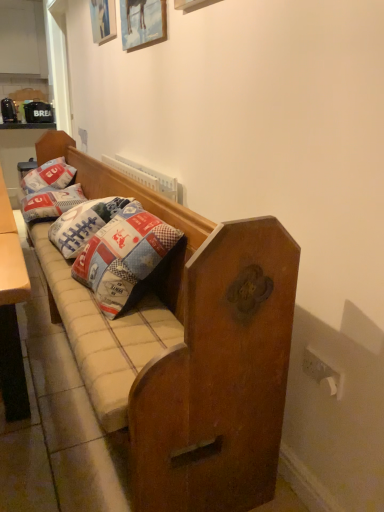
Locate an element on the screen. The image size is (384, 512). wooden studio couch at center is located at coordinates (186, 353).

This screenshot has width=384, height=512. In order to click on wooden picture frame at upper center, marked as the second picture frame in a left-to-right arrangement in this screenshot , I will do `click(142, 22)`.

Identify the location of white glossy cabinet at upper left. (22, 38).

Image resolution: width=384 pixels, height=512 pixels. What do you see at coordinates (22, 38) in the screenshot?
I see `white glossy cabinet at upper left` at bounding box center [22, 38].

Describe the element at coordinates (50, 203) in the screenshot. I see `patchwork fabric pillow at left, arranged as the 1th pillow when viewed from the front` at that location.

You are a GUI agent. You are given a task and a screenshot of the screen. Output one action in this format:
    pyautogui.click(x=<x>, y=<y>)
    Task: Click on the wooden picture frame at upper center, the second picture frame viewed from the right
    
    Given the screenshot: What is the action you would take?
    pyautogui.click(x=103, y=20)

From the image's perspective, which one is positioned lower, white glossy cabinet at upper left or patchwork fabric pillow at left, the second pillow in the front-to-back sequence?

patchwork fabric pillow at left, the second pillow in the front-to-back sequence, appears lower in the image.

At what (x,y) coordinates should I click in order to perform the action: click on cabinetry above the patchwork fabric pillow at left, the second pillow in the front-to-back sequence (from a real-world perspective). Please return your answer as a coordinate pair (x, y). The image size is (384, 512). Looking at the image, I should click on (22, 38).

Is white glossy cabinet at upper left aimed at patchwork fabric pillow at left, which is counted as the 1th pillow, starting from the back?

Yes, white glossy cabinet at upper left is turned towards patchwork fabric pillow at left, which is counted as the 1th pillow, starting from the back.

Would you say white glossy cabinet at upper left is a long distance from patchwork fabric pillow at left, which is counted as the 1th pillow, starting from the back?

Absolutely, white glossy cabinet at upper left is distant from patchwork fabric pillow at left, which is counted as the 1th pillow, starting from the back.

Based on the photo, is patchwork fabric pillow at left, placed as the 2th pillow when sorted from back to front, facing away from wooden studio couch at center?

Yes, patchwork fabric pillow at left, placed as the 2th pillow when sorted from back to front,'s orientation is away from wooden studio couch at center.

I want to click on the 1st pillow above the wooden studio couch at center (from the image's perspective), so click(50, 203).

Is patchwork fabric pillow at left, arranged as the 1th pillow when viewed from the front, taller than wooden studio couch at center?

In fact, patchwork fabric pillow at left, arranged as the 1th pillow when viewed from the front, may be shorter than wooden studio couch at center.

Can you confirm if patchwork fabric pillow at left, placed as the 2th pillow when sorted from back to front, is smaller than wooden studio couch at center?

Correct, patchwork fabric pillow at left, placed as the 2th pillow when sorted from back to front, occupies less space than wooden studio couch at center.

Choose the correct answer: Is wooden picture frame at upper center, which is the 2th picture frame from bottom to top, inside patchwork fabric pillow at left, the second pillow in the front-to-back sequence, or outside it?

The correct answer is: outside.

Looking at their sizes, would you say wooden picture frame at upper center, marked as the first picture frame in a top-to-bottom arrangement, is wider or thinner than patchwork fabric pillow at left, which is counted as the 1th pillow, starting from the back?

wooden picture frame at upper center, marked as the first picture frame in a top-to-bottom arrangement, is thinner than patchwork fabric pillow at left, which is counted as the 1th pillow, starting from the back.

Does point (102, 41) appear closer or farther from the camera than point (62, 173)?

Point (102, 41).

Is wooden picture frame at upper center, which is the 1th picture frame from back to front, positioned with its back to patchwork fabric pillow at left, the second pillow in the front-to-back sequence?

That's not correct — wooden picture frame at upper center, which is the 1th picture frame from back to front, is not looking away from patchwork fabric pillow at left, the second pillow in the front-to-back sequence.

Looking at this image, could you tell me if white glossy cabinet at upper left is facing wooden picture frame at upper center, the second picture frame viewed from the front?

Yes.

From the image's perspective, is white glossy cabinet at upper left above or below wooden picture frame at upper center, the second picture frame viewed from the front?

white glossy cabinet at upper left is situated higher than wooden picture frame at upper center, the second picture frame viewed from the front, in the image.

Where is `picture frame that is the 1st object located below the white glossy cabinet at upper left (from the image's perspective)`? Image resolution: width=384 pixels, height=512 pixels. picture frame that is the 1st object located below the white glossy cabinet at upper left (from the image's perspective) is located at coordinates [103, 20].

Which of these two, patchwork fabric pillow at left, which is counted as the 1th pillow, starting from the back, or patchwork fabric pillow at left, arranged as the 1th pillow when viewed from the front, is bigger?

With larger size is patchwork fabric pillow at left, which is counted as the 1th pillow, starting from the back.

This screenshot has height=512, width=384. What are the coordinates of `pillow located above the patchwork fabric pillow at left, placed as the 2th pillow when sorted from back to front (from a real-world perspective)` in the screenshot? It's located at (49, 176).

Is patchwork fabric pillow at left, the second pillow in the front-to-back sequence, situated inside patchwork fabric pillow at left, arranged as the 1th pillow when viewed from the front, or outside?

patchwork fabric pillow at left, the second pillow in the front-to-back sequence, is not inside patchwork fabric pillow at left, arranged as the 1th pillow when viewed from the front, it's outside.

Is patchwork fabric pillow at left, the second pillow in the front-to-back sequence, positioned with its back to patchwork fabric pillow at left, placed as the 2th pillow when sorted from back to front?

patchwork fabric pillow at left, the second pillow in the front-to-back sequence, is not turned away from patchwork fabric pillow at left, placed as the 2th pillow when sorted from back to front.

Considering the points (25, 219) and (1, 36), which point is in front, point (25, 219) or point (1, 36)?

Point (25, 219)

Which object is further away from the camera taking this photo, patchwork fabric pillow at left, placed as the 2th pillow when sorted from back to front, or white glossy cabinet at upper left?

white glossy cabinet at upper left is further away from the camera.

Does patchwork fabric pillow at left, arranged as the 1th pillow when viewed from the front, have a greater height compared to white glossy cabinet at upper left?

No, patchwork fabric pillow at left, arranged as the 1th pillow when viewed from the front, is not taller than white glossy cabinet at upper left.

This screenshot has width=384, height=512. Identify the location of the 2nd picture frame above when counting from the patchwork fabric pillow at left, arranged as the 1th pillow when viewed from the front (from the image's perspective). (103, 20).

Between wooden picture frame at upper center, which is the 1th picture frame from back to front, and patchwork fabric pillow at left, arranged as the 1th pillow when viewed from the front, which one has more height?

With more height is wooden picture frame at upper center, which is the 1th picture frame from back to front.

Does wooden picture frame at upper center, marked as the first picture frame in a left-to-right arrangement, have a lesser width compared to patchwork fabric pillow at left, placed as the 2th pillow when sorted from back to front?

Yes, wooden picture frame at upper center, marked as the first picture frame in a left-to-right arrangement, is thinner than patchwork fabric pillow at left, placed as the 2th pillow when sorted from back to front.

At what (x,y) coordinates should I click in order to perform the action: click on cabinetry above the patchwork fabric pillow at left, which is counted as the 1th pillow, starting from the back (from a real-world perspective). Please return your answer as a coordinate pair (x, y). Looking at the image, I should click on (22, 38).

Find the location of a particular element. studio couch on the right of patchwork fabric pillow at left, placed as the 2th pillow when sorted from back to front is located at coordinates (186, 353).

Looking at this image, considering their positions, is wooden picture frame at upper center, the second picture frame viewed from the front, positioned closer to wooden picture frame at upper center, the 1th picture frame in the right-to-left sequence, than patchwork fabric pillow at left, which is counted as the 1th pillow, starting from the back?

Based on the image, wooden picture frame at upper center, the second picture frame viewed from the front, appears to be nearer to wooden picture frame at upper center, the 1th picture frame in the right-to-left sequence.

Consider the image. From the image, which object appears to be nearer to patchwork fabric pillow at left, the second pillow in the front-to-back sequence, wooden studio couch at center or white glossy cabinet at upper left?

Based on the image, wooden studio couch at center appears to be nearer to patchwork fabric pillow at left, the second pillow in the front-to-back sequence.

Considering their positions, is wooden picture frame at upper center, which ranks as the first picture frame in front-to-back order, positioned further to patchwork fabric pillow at left, arranged as the 1th pillow when viewed from the front, than wooden picture frame at upper center, marked as the first picture frame in a top-to-bottom arrangement?

wooden picture frame at upper center, marked as the first picture frame in a top-to-bottom arrangement, is positioned further to the anchor patchwork fabric pillow at left, arranged as the 1th pillow when viewed from the front.

When comparing their distances from patchwork fabric pillow at left, placed as the 2th pillow when sorted from back to front, does patchwork fabric pillow at left, the second pillow in the front-to-back sequence, or wooden studio couch at center seem closer?

Based on the image, patchwork fabric pillow at left, the second pillow in the front-to-back sequence, appears to be nearer to patchwork fabric pillow at left, placed as the 2th pillow when sorted from back to front.

Estimate the real-world distances between objects in this image. Which object is closer to wooden picture frame at upper center, the 1th picture frame in the right-to-left sequence, patchwork fabric pillow at left, the second pillow in the front-to-back sequence, or wooden picture frame at upper center, which is the 2th picture frame from bottom to top?

wooden picture frame at upper center, which is the 2th picture frame from bottom to top, lies closer to wooden picture frame at upper center, the 1th picture frame in the right-to-left sequence, than the other object.

Which object lies further to the anchor point patchwork fabric pillow at left, placed as the 2th pillow when sorted from back to front, white glossy cabinet at upper left or wooden picture frame at upper center, the 1th picture frame from the bottom?

white glossy cabinet at upper left lies further to patchwork fabric pillow at left, placed as the 2th pillow when sorted from back to front, than the other object.

Which object lies nearer to the anchor point wooden studio couch at center, patchwork fabric pillow at left, which is counted as the 1th pillow, starting from the back, or wooden picture frame at upper center, the second picture frame viewed from the front?

patchwork fabric pillow at left, which is counted as the 1th pillow, starting from the back, is positioned closer to the anchor wooden studio couch at center.

Considering their positions, is patchwork fabric pillow at left, placed as the 2th pillow when sorted from back to front, positioned closer to wooden picture frame at upper center, which is the 1th picture frame from back to front, than patchwork fabric pillow at left, the second pillow in the front-to-back sequence?

patchwork fabric pillow at left, the second pillow in the front-to-back sequence, lies closer to wooden picture frame at upper center, which is the 1th picture frame from back to front, than the other object.

Where is `pillow positioned between wooden picture frame at upper center, which appears as the 2th picture frame when viewed from the top, and patchwork fabric pillow at left, which is counted as the 1th pillow, starting from the back, from near to far`? The height and width of the screenshot is (512, 384). pillow positioned between wooden picture frame at upper center, which appears as the 2th picture frame when viewed from the top, and patchwork fabric pillow at left, which is counted as the 1th pillow, starting from the back, from near to far is located at coordinates (50, 203).

Find the location of a particular element. This screenshot has height=512, width=384. picture frame between wooden studio couch at center and wooden picture frame at upper center, which is the 2th picture frame from bottom to top, from front to back is located at coordinates (142, 22).

Locate an element on the screen. The height and width of the screenshot is (512, 384). pillow between wooden studio couch at center and patchwork fabric pillow at left, the second pillow in the front-to-back sequence, from front to back is located at coordinates (50, 203).

You are a GUI agent. You are given a task and a screenshot of the screen. Output one action in this format:
    pyautogui.click(x=<x>, y=<y>)
    Task: Click on the pillow between white glossy cabinet at upper left and patchwork fabric pillow at left, placed as the 2th pillow when sorted from back to front, from top to bottom
    The height and width of the screenshot is (512, 384).
    Given the screenshot: What is the action you would take?
    pyautogui.click(x=49, y=176)